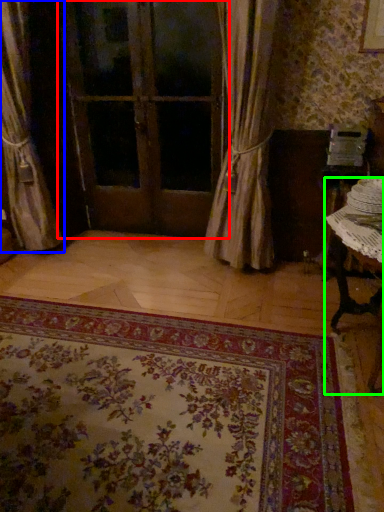
Question: Based on their relative distances, which object is farther from door (highlighted by a red box)? Choose from curtain (highlighted by a blue box) and table (highlighted by a green box).

Choices:
 (A) curtain
 (B) table

Answer: (B)